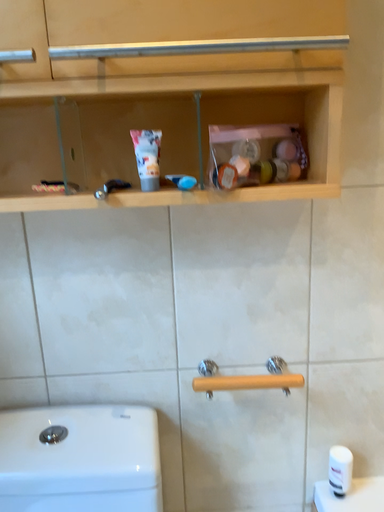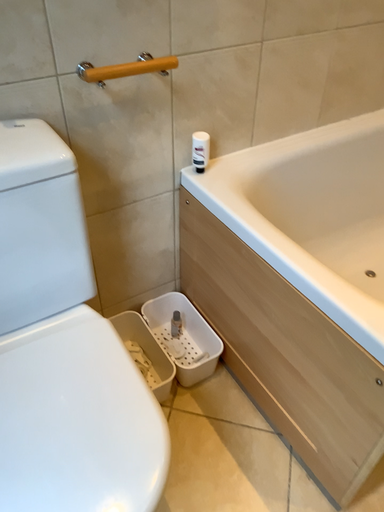
Question: How did the camera likely rotate when shooting the video?

Choices:
 (A) rotated upward
 (B) rotated downward

Answer: (B)